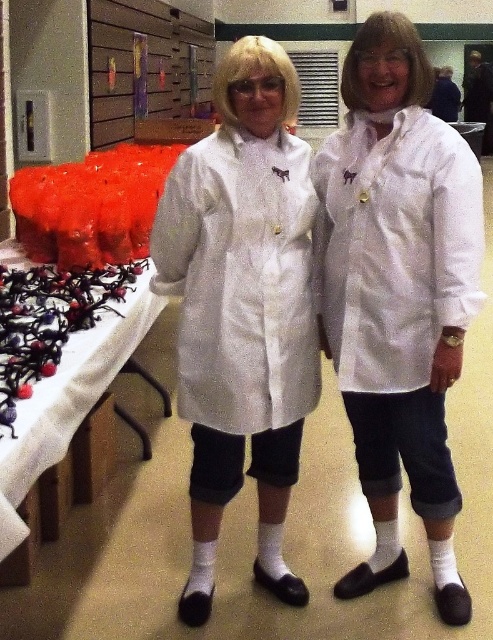
Question: Considering the relative positions of white fabric lab coat at center and white textured lab coat at center in the image provided, where is white fabric lab coat at center located with respect to white textured lab coat at center?

Choices:
 (A) above
 (B) below

Answer: (B)

Question: Which point appears closest to the camera in this image?

Choices:
 (A) (59, 486)
 (B) (301, 378)
 (C) (340, 264)
 (D) (405, 72)

Answer: (D)

Question: Which point is farther to the camera?

Choices:
 (A) (468, 211)
 (B) (398, 168)
 (C) (249, 268)
 (D) (72, 470)

Answer: (D)

Question: Which object appears closest to the camera in this image?

Choices:
 (A) white fabric lab coat at center
 (B) white textured lab coat at center

Answer: (A)

Question: Can you confirm if white textured lab coat at center is smaller than white textured coat at center?

Choices:
 (A) no
 (B) yes

Answer: (B)

Question: Is white textured coat at center bigger than white fabric table at lower left?

Choices:
 (A) no
 (B) yes

Answer: (A)